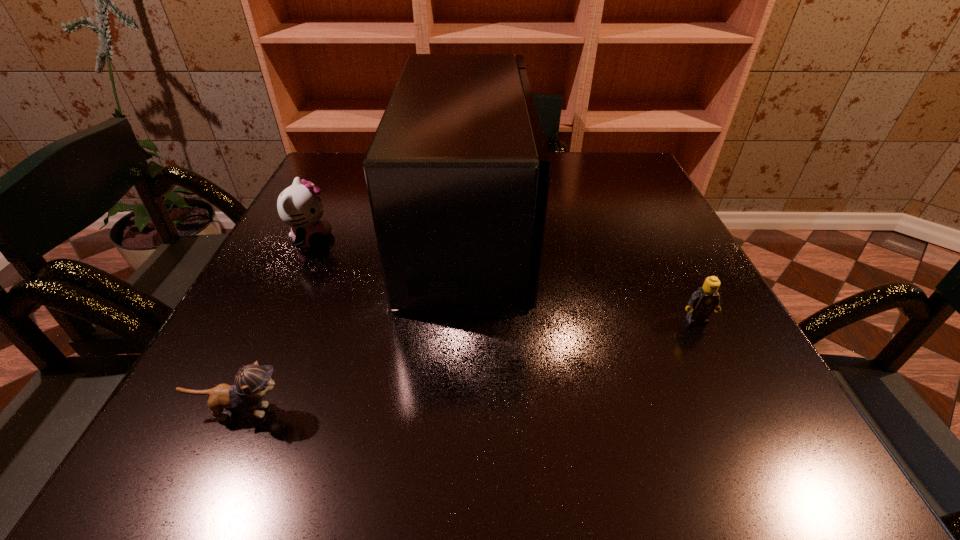
This screenshot has width=960, height=540. I want to click on the second object from right to left, so click(x=458, y=175).

Locate an element on the screen. microwave_oven is located at coordinates (458, 175).

The width and height of the screenshot is (960, 540). Identify the location of the third shortest object. (298, 206).

At what (x,y) coordinates should I click in order to perform the action: click on the taller kitten. Please return your answer as a coordinate pair (x, y). Looking at the image, I should click on (298, 206).

In order to click on the nearest object in this screenshot , I will do `click(252, 382)`.

Where is `the shorter kitten`? This screenshot has width=960, height=540. the shorter kitten is located at coordinates (252, 382).

Image resolution: width=960 pixels, height=540 pixels. I want to click on Lego, so click(705, 300).

You are a GUI agent. You are given a task and a screenshot of the screen. Output one action in this format:
    pyautogui.click(x=<x>, y=<y>)
    Task: Click on the free space located on the front-facing side of the third object from left to right
    
    Given the screenshot: What is the action you would take?
    [596, 228]

Find the location of a particular element. vacant space located on the front-facing side of the farther kitten is located at coordinates (476, 240).

The image size is (960, 540). I want to click on free spot located on the front-facing side of the nearest object, so click(x=540, y=411).